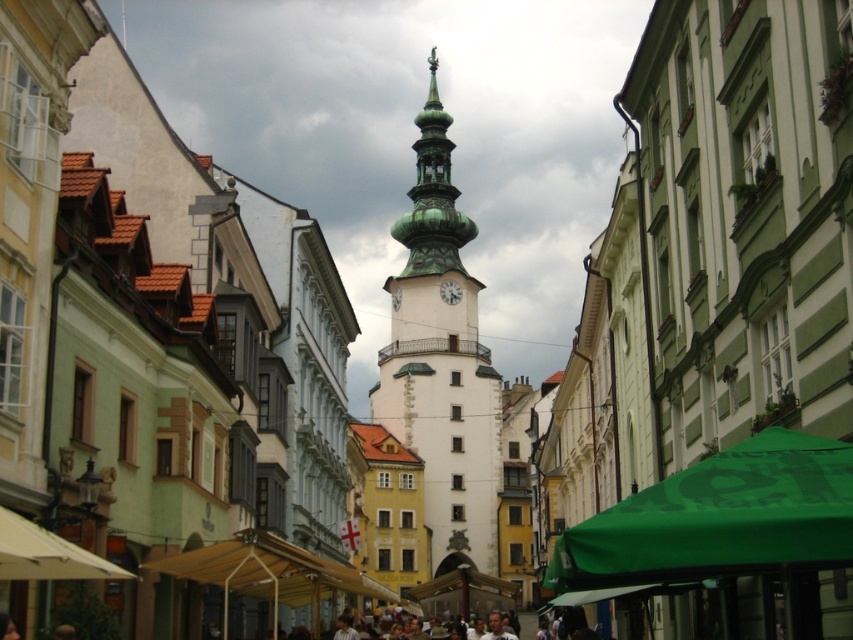
Question: Among these objects, which one is farthest from the camera?

Choices:
 (A) green copper clock tower at center
 (B) green fabric canopy at lower right
 (C) white stone clock at center
 (D) yellow fabric canopy at lower center

Answer: (C)

Question: Estimate the real-world distances between objects in this image. Which object is farther from the green copper clock tower at center?

Choices:
 (A) yellow fabric canopy at lower center
 (B) beige fabric canopy at lower left
 (C) white stone clock at center

Answer: (B)

Question: Observing the image, what is the correct spatial positioning of yellow fabric canopy at lower center in reference to white stone clock at center?

Choices:
 (A) left
 (B) right

Answer: (A)

Question: Considering the real-world distances, which object is farthest from the green fabric canopy at lower right?

Choices:
 (A) yellow fabric canopy at lower center
 (B) white stone clock at center
 (C) green copper clock tower at center

Answer: (B)

Question: Does green fabric canopy at lower right lie behind white stone clock at center?

Choices:
 (A) no
 (B) yes

Answer: (A)

Question: Is beige fabric canopy at lower left to the right of white stone clock at center from the viewer's perspective?

Choices:
 (A) yes
 (B) no

Answer: (B)